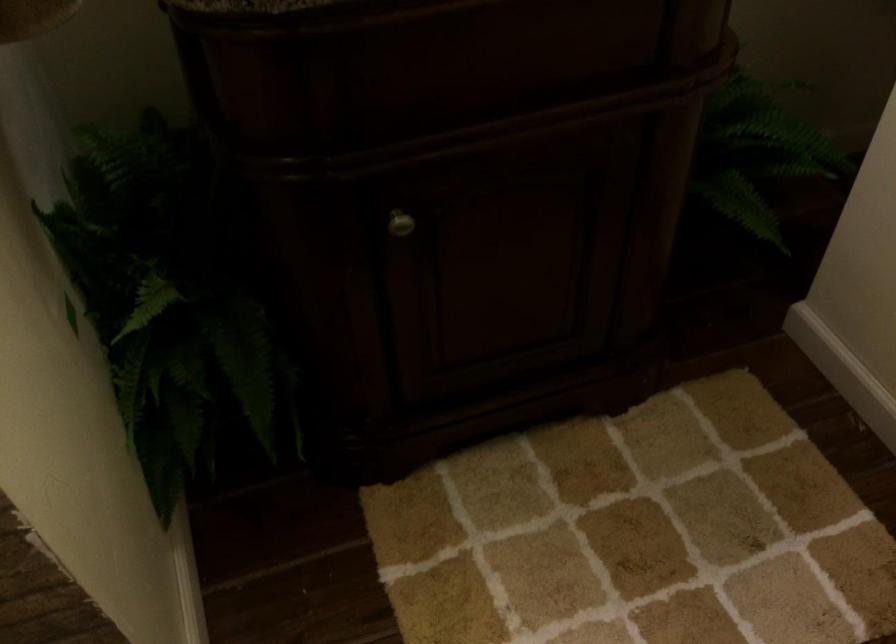
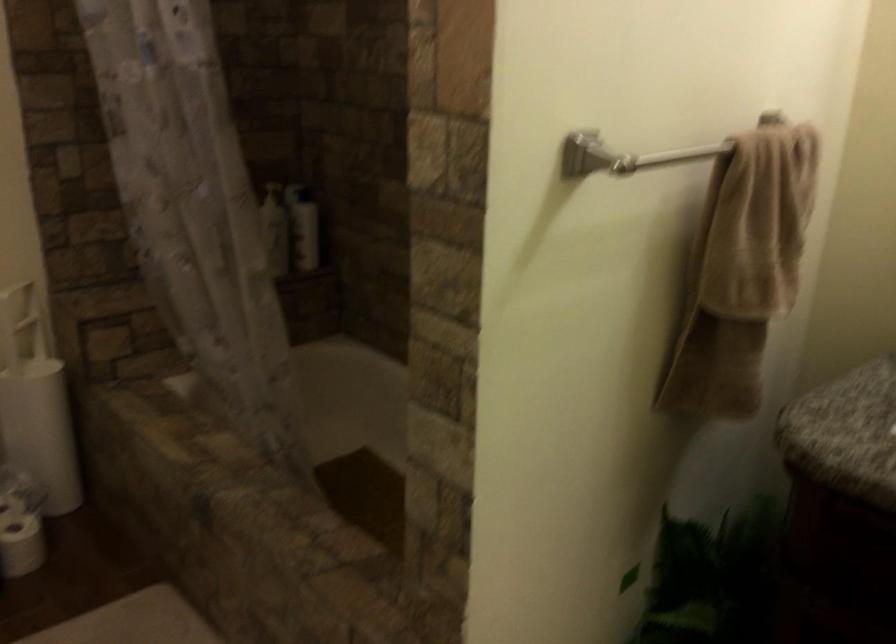
Question: The camera is either moving clockwise (left) or counter-clockwise (right) around the object. The first image is from the beginning of the video and the second image is from the end. Is the camera moving left or right when shooting the video?

Choices:
 (A) Left
 (B) Right

Answer: (B)